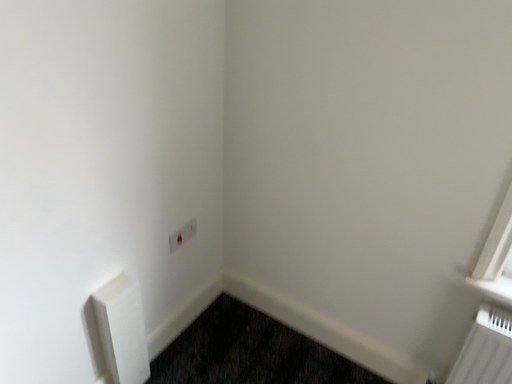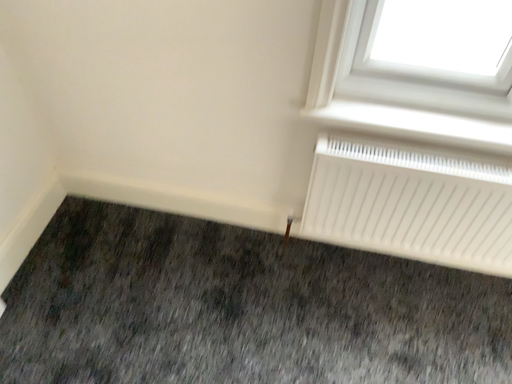
Question: Which way did the camera rotate in the video?

Choices:
 (A) rotated upward
 (B) rotated downward

Answer: (B)